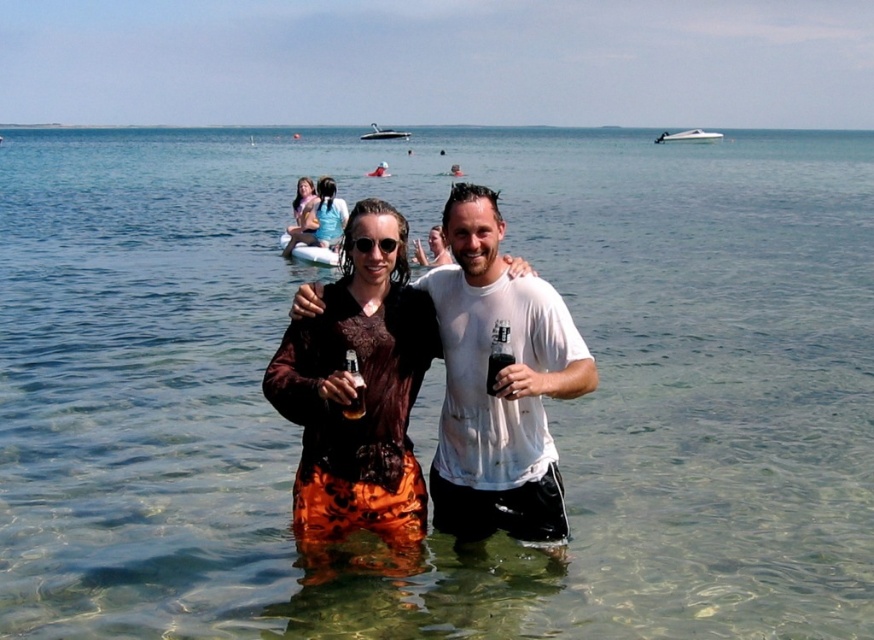
You are a photographer trying to capture the translucent glass bottle at center in the beach scene. Using the coordinates provided, can you confirm if the point marked at (x=355, y=387) corresponds to the location of the bottle?

Yes, the translucent glass bottle at center is represented by the point marked at (x=355, y=387), so the coordinates correspond to the bottle.

Looking at this image, you are standing at the beach and want to reach the point marked as point (323, 196). If you can walk 30 feet per minute, how many minutes will it take you to reach that point?

The distance between you and point (323, 196) is 60.52 feet. At a walking speed of 30 feet per minute, it will take approximately 2.02 minutes to reach the point.